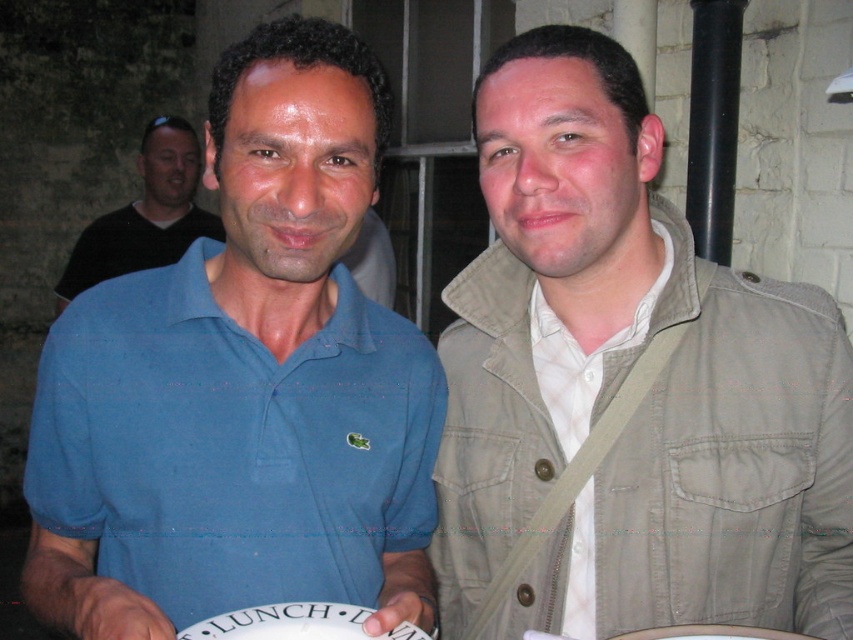
Which is below, blue cotton polo shirt at center or black shirt at upper left?

blue cotton polo shirt at center is lower down.

Is blue cotton polo shirt at center bigger than black shirt at upper left?

No, blue cotton polo shirt at center is not bigger than black shirt at upper left.

Is point (309, 84) farther from viewer compared to point (161, 176)?

No, (309, 84) is closer to viewer.

You are a GUI agent. You are given a task and a screenshot of the screen. Output one action in this format:
    pyautogui.click(x=<x>, y=<y>)
    Task: Click on the blue cotton polo shirt at center
    This screenshot has height=640, width=853.
    Given the screenshot: What is the action you would take?
    pyautogui.click(x=244, y=384)

Between blue cotton polo shirt at center and white textured shirt at center, which one appears on the left side from the viewer's perspective?

From the viewer's perspective, blue cotton polo shirt at center appears more on the left side.

Based on the photo, is blue cotton polo shirt at center to the left of white textured shirt at center from the viewer's perspective?

Correct, you'll find blue cotton polo shirt at center to the left of white textured shirt at center.

Locate an element on the screen. This screenshot has width=853, height=640. blue cotton polo shirt at center is located at coordinates (244, 384).

Identify the location of blue cotton polo shirt at center. (244, 384).

Does khaki cotton jacket at center appear under black shirt at upper left?

Yes, khaki cotton jacket at center is below black shirt at upper left.

Who is more forward, (485, 486) or (122, 262)?

Point (485, 486) is in front.

Does point (608, 260) come in front of point (99, 257)?

That is True.

Locate an element on the screen. khaki cotton jacket at center is located at coordinates (627, 387).